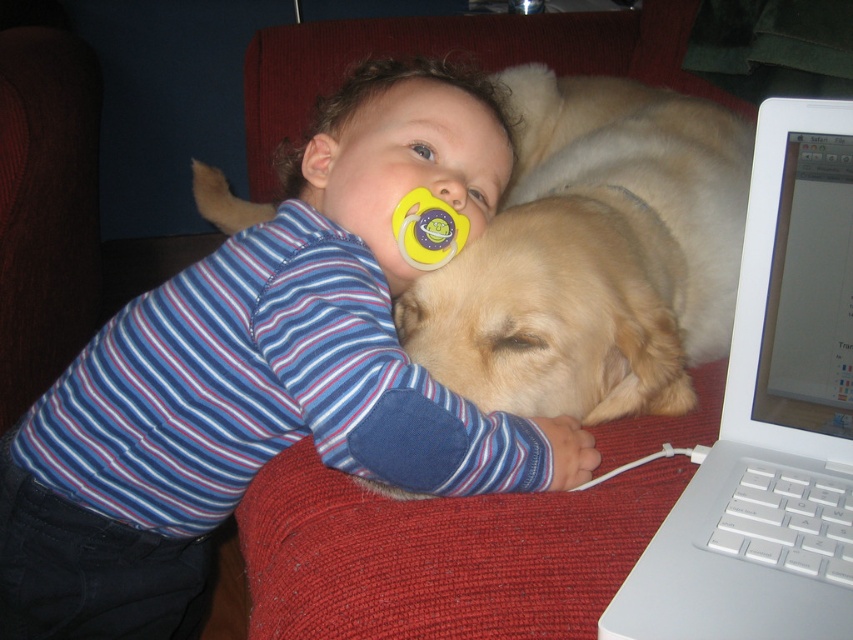
Does white plastic laptop at right have a lesser width compared to yellow rubber pacifier at upper center?

No.

Who is lower down, white plastic laptop at right or yellow rubber pacifier at upper center?

Positioned lower is white plastic laptop at right.

What do you see at coordinates (770, 417) in the screenshot? I see `white plastic laptop at right` at bounding box center [770, 417].

I want to click on white plastic laptop at right, so click(x=770, y=417).

Does golden fur dog at center appear on the right side of white plastic laptop at right?

No, golden fur dog at center is not to the right of white plastic laptop at right.

Which is more to the right, golden fur dog at center or white plastic laptop at right?

white plastic laptop at right is more to the right.

The width and height of the screenshot is (853, 640). I want to click on golden fur dog at center, so click(593, 256).

Who is positioned more to the left, golden fur dog at center or yellow rubber pacifier at upper center?

yellow rubber pacifier at upper center is more to the left.

Looking at this image, can you confirm if golden fur dog at center is positioned to the left of yellow rubber pacifier at upper center?

In fact, golden fur dog at center is to the right of yellow rubber pacifier at upper center.

Which is behind, point (563, 92) or point (405, 204)?

Point (563, 92)

Locate an element on the screen. The image size is (853, 640). golden fur dog at center is located at coordinates (593, 256).